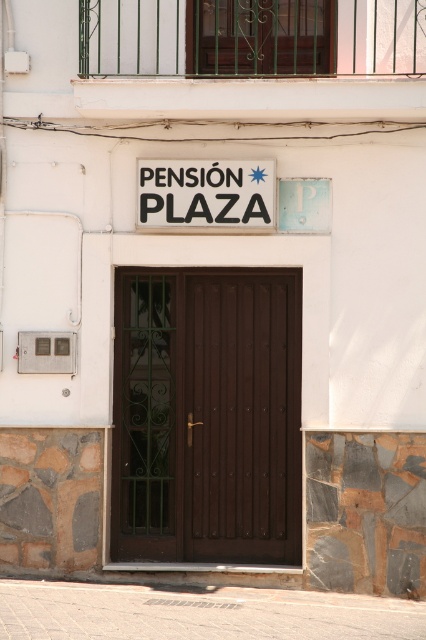
Question: Which of the following is the farthest from the observer?

Choices:
 (A) green wrought iron gate at upper center
 (B) brown wooden door at center

Answer: (B)

Question: Is brown wooden door at center to the right of matte plastic sign at center from the viewer's perspective?

Choices:
 (A) no
 (B) yes

Answer: (B)

Question: Which object is farther from the camera taking this photo?

Choices:
 (A) green wrought iron gate at upper center
 (B) brown wooden door at center

Answer: (B)

Question: Is brown wooden door at center below green wrought iron gate at upper center?

Choices:
 (A) yes
 (B) no

Answer: (A)

Question: Can you confirm if brown wooden door at center is positioned below matte plastic sign at center?

Choices:
 (A) no
 (B) yes

Answer: (B)

Question: Estimate the real-world distances between objects in this image. Which object is closer to the matte plastic sign at center?

Choices:
 (A) brown wooden door at center
 (B) green wrought iron gate at upper center

Answer: (A)